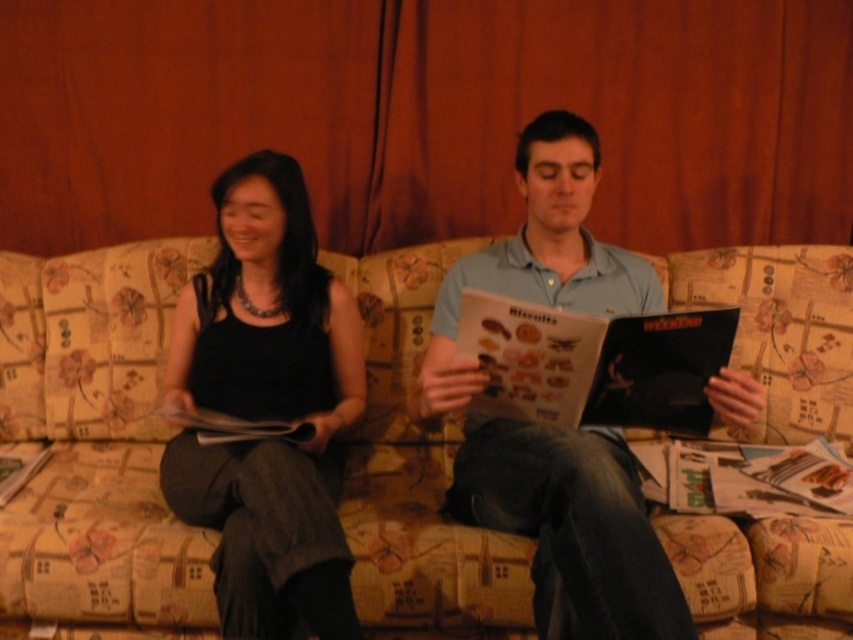
You are designing a living room and want to place a large armchair next to the floral fabric couch at center and the light blue cotton shirt at center. Which object should the armchair be placed next to to ensure it doesn

The armchair should be placed next to the light blue cotton shirt at center because the floral fabric couch at center is smaller in size compared to the light blue cotton shirt at center, so the armchair would fit better next to the larger object.

You are designing a living room layout and need to place the floral fabric couch at center and the black fabric dress at center in the same space. Based on their sizes, which object should be placed closer to the entrance to ensure there is enough space for both?

The floral fabric couch at center has a lesser height compared to the black fabric dress at center, so the taller black fabric dress at center should be placed closer to the entrance to allow sufficient space for the shorter couch.